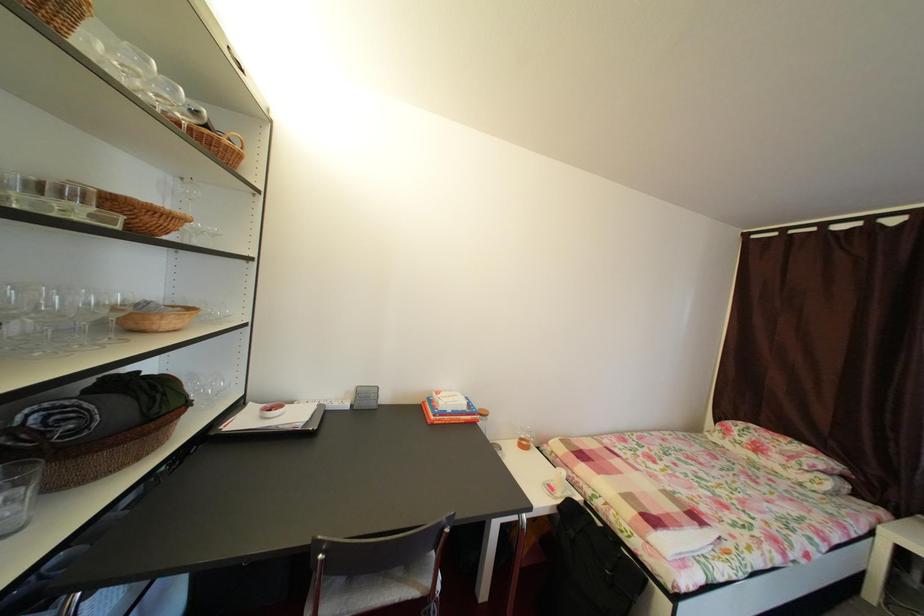
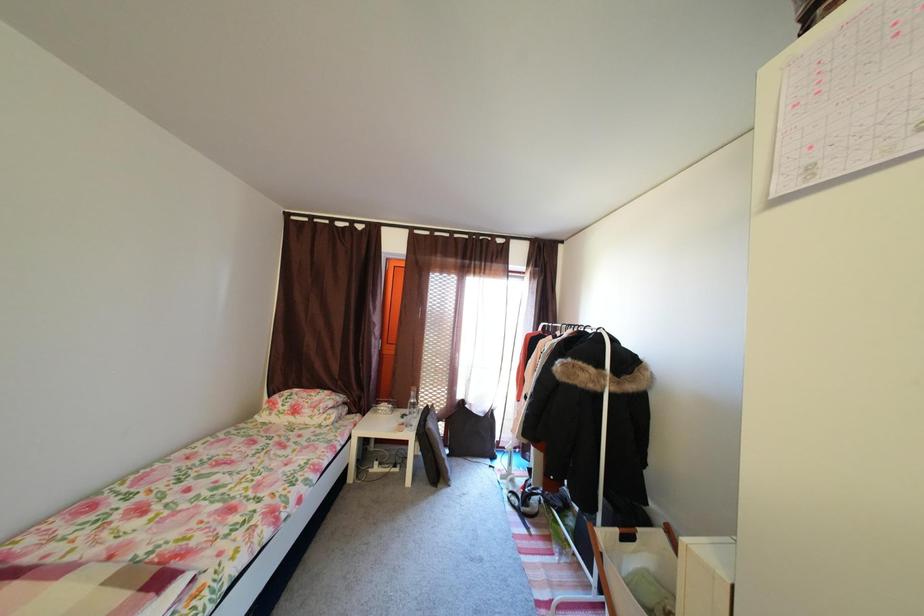
Question: The images are taken continuously from a first-person perspective. In which direction is your viewpoint rotating?

Choices:
 (A) Left
 (B) Right
 (C) Up
 (D) Down

Answer: (B)